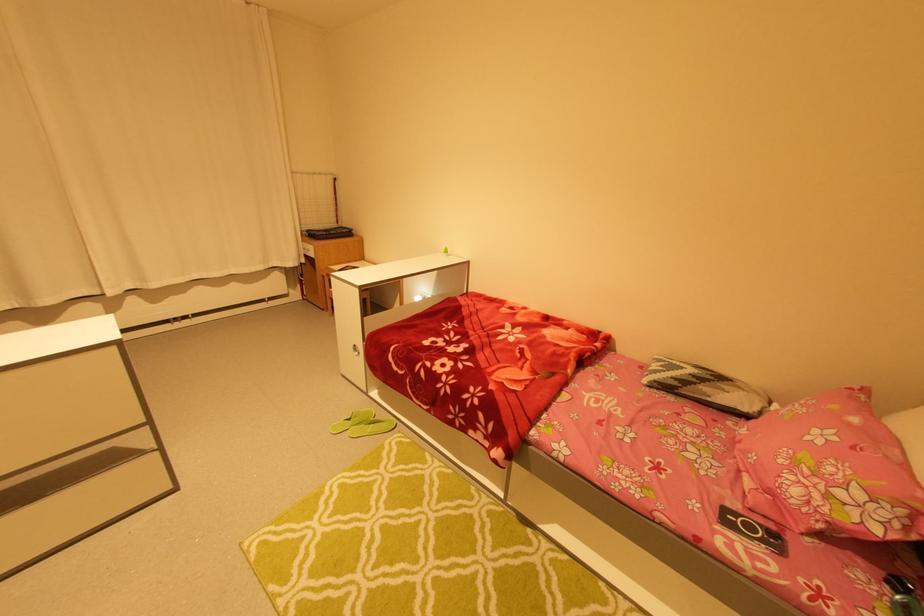
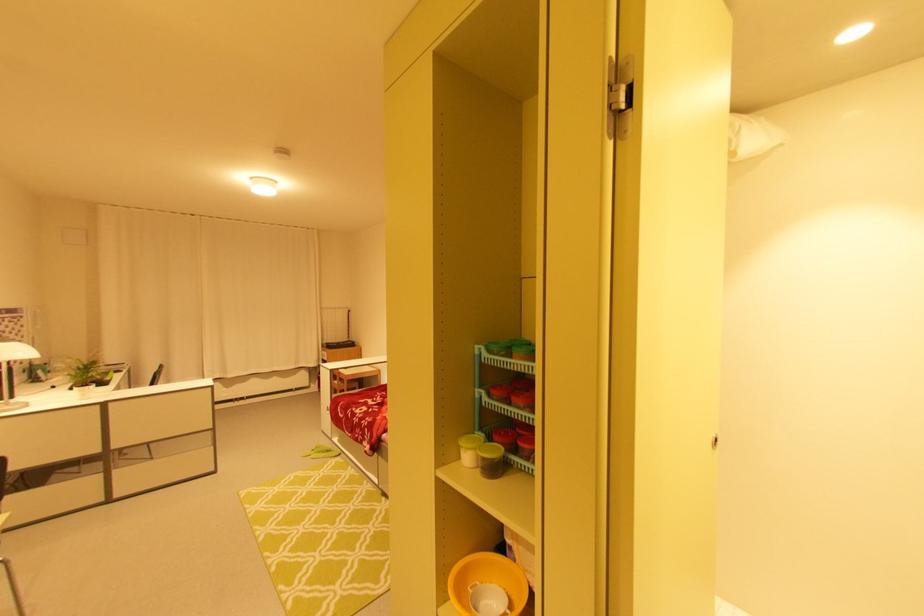
What movement of the cameraman would produce the second image?

The cameraman walked toward right, backward.